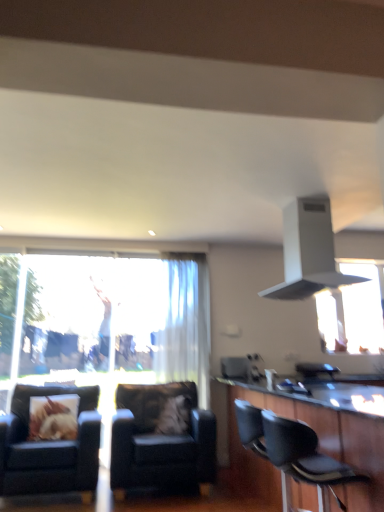
Question: Does leather armchair at center, marked as the second chair in a right-to-left arrangement, lie behind black leather chair at lower right, which appears as the 3th chair when viewed from the left?

Choices:
 (A) yes
 (B) no

Answer: (A)

Question: From a real-world perspective, is leather armchair at center, the 1th chair from the back, on black leather chair at lower right, the first chair when ordered from front to back?

Choices:
 (A) no
 (B) yes

Answer: (A)

Question: From the image's perspective, is leather armchair at center, the 1th chair from the back, below black leather chair at lower right, which is the first chair in right-to-left order?

Choices:
 (A) yes
 (B) no

Answer: (A)

Question: Is leather armchair at center, the 1th chair from the back, with black leather chair at lower right, which is the first chair in right-to-left order?

Choices:
 (A) yes
 (B) no

Answer: (B)

Question: Considering the relative positions of leather armchair at center, the 1th chair from the back, and black leather chair at lower right, the first chair when ordered from front to back, in the image provided, is leather armchair at center, the 1th chair from the back, to the left of black leather chair at lower right, the first chair when ordered from front to back, from the viewer's perspective?

Choices:
 (A) no
 (B) yes

Answer: (B)

Question: In the image, is black leather barstools at lower right positioned in front of or behind printed fabric pillow at left, the second pillow positioned from the right?

Choices:
 (A) behind
 (B) front

Answer: (B)

Question: From a real-world perspective, is black leather barstools at lower right positioned above or below printed fabric pillow at left, placed as the 1th pillow when sorted from left to right?

Choices:
 (A) above
 (B) below

Answer: (B)

Question: In terms of size, does black leather barstools at lower right appear bigger or smaller than printed fabric pillow at left, the second pillow positioned from the right?

Choices:
 (A) small
 (B) big

Answer: (B)

Question: Is black leather barstools at lower right taller or shorter than printed fabric pillow at left, the second pillow positioned from the right?

Choices:
 (A) tall
 (B) short

Answer: (A)

Question: Would you say black leather barstools at lower right is inside or outside fluffy fabric pillow at center, the second pillow from the left?

Choices:
 (A) inside
 (B) outside

Answer: (B)

Question: Is black leather barstools at lower right taller or shorter than fluffy fabric pillow at center, the second pillow from the left?

Choices:
 (A) tall
 (B) short

Answer: (A)

Question: Considering the positions of black leather barstools at lower right and fluffy fabric pillow at center, the second pillow from the left, in the image, is black leather barstools at lower right wider or thinner than fluffy fabric pillow at center, the second pillow from the left,?

Choices:
 (A) thin
 (B) wide

Answer: (B)

Question: From the image's perspective, relative to fluffy fabric pillow at center, the second pillow from the left, is black leather barstools at lower right above or below?

Choices:
 (A) above
 (B) below

Answer: (A)

Question: From a real-world perspective, is black leather barstools at lower right above or below white sheer curtain at center?

Choices:
 (A) below
 (B) above

Answer: (A)

Question: Is black leather barstools at lower right inside the boundaries of white sheer curtain at center, or outside?

Choices:
 (A) inside
 (B) outside

Answer: (B)